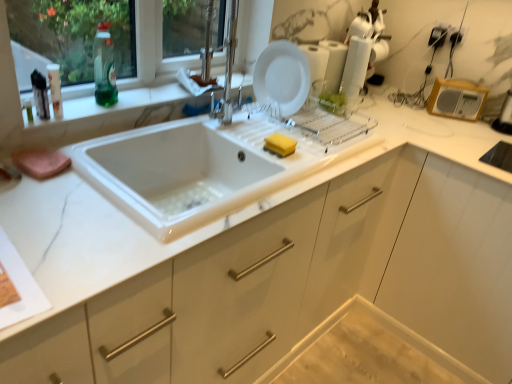
You are a GUI agent. You are given a task and a screenshot of the screen. Output one action in this format:
    pyautogui.click(x=<x>, y=<y>)
    Task: Click on the vacant region to the left of yellow sponge at sink
    This screenshot has width=512, height=384.
    Given the screenshot: What is the action you would take?
    pyautogui.click(x=238, y=135)